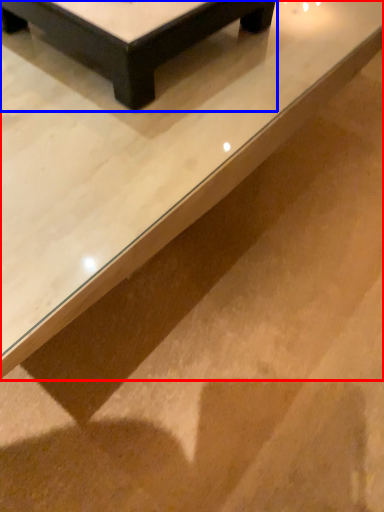
Question: Among these objects, which one is farthest to the camera, table (highlighted by a red box) or table (highlighted by a blue box)?

Choices:
 (A) table
 (B) table

Answer: (B)